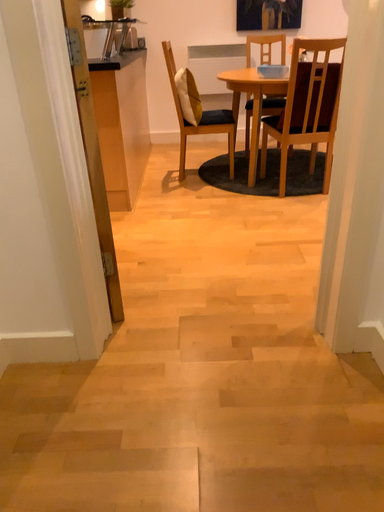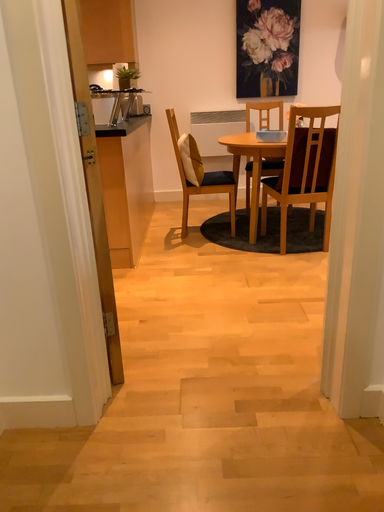
Question: How did the camera likely rotate when shooting the video?

Choices:
 (A) rotated downward
 (B) rotated upward

Answer: (B)